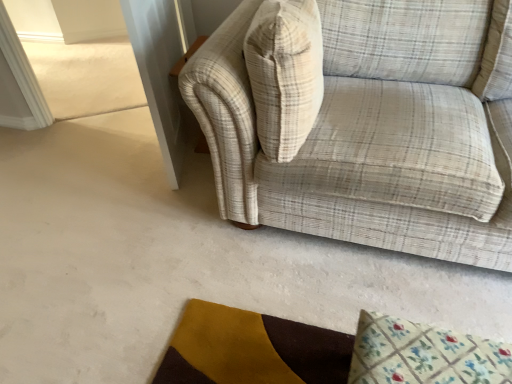
At what (x,y) coordinates should I click in order to perform the action: click on free space above floral fabric mat at lower right (from a real-world perspective). Please return your answer as a coordinate pair (x, y). Looking at the image, I should click on (437, 353).